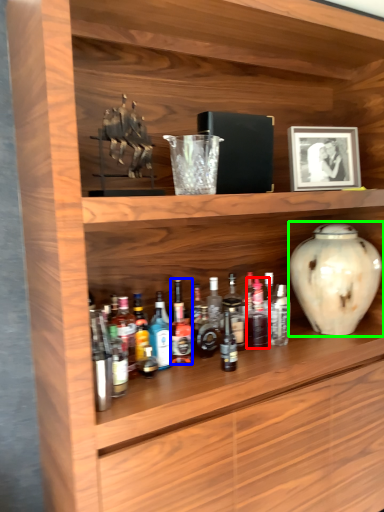
Question: Which object is positioned closest to bottle (highlighted by a red box)? Select from bottle (highlighted by a blue box) and vase (highlighted by a green box).

Choices:
 (A) bottle
 (B) vase

Answer: (B)